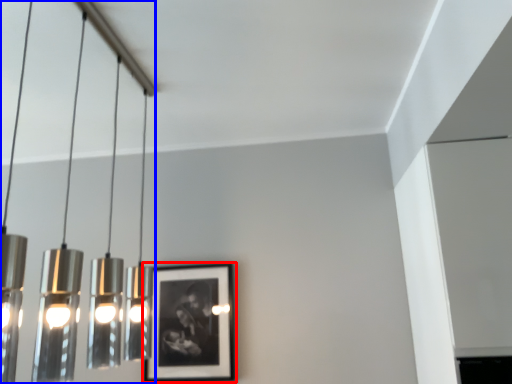
Question: Which object is further to the camera taking this photo, picture frame (highlighted by a red box) or lamp (highlighted by a blue box)?

Choices:
 (A) picture frame
 (B) lamp

Answer: (A)